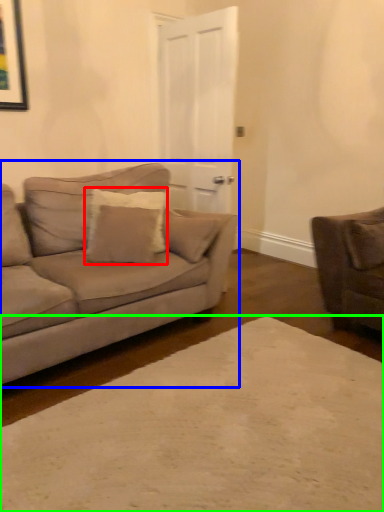
Question: Estimate the real-world distances between objects in this image. Which object is closer to pillow (highlighted by a red box), studio couch (highlighted by a blue box) or plain (highlighted by a green box)?

Choices:
 (A) studio couch
 (B) plain

Answer: (A)